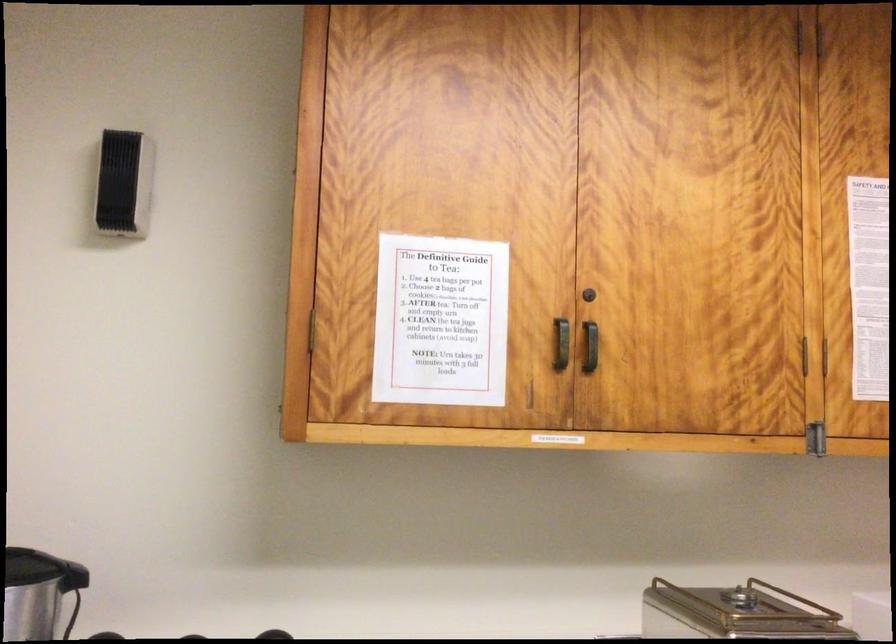
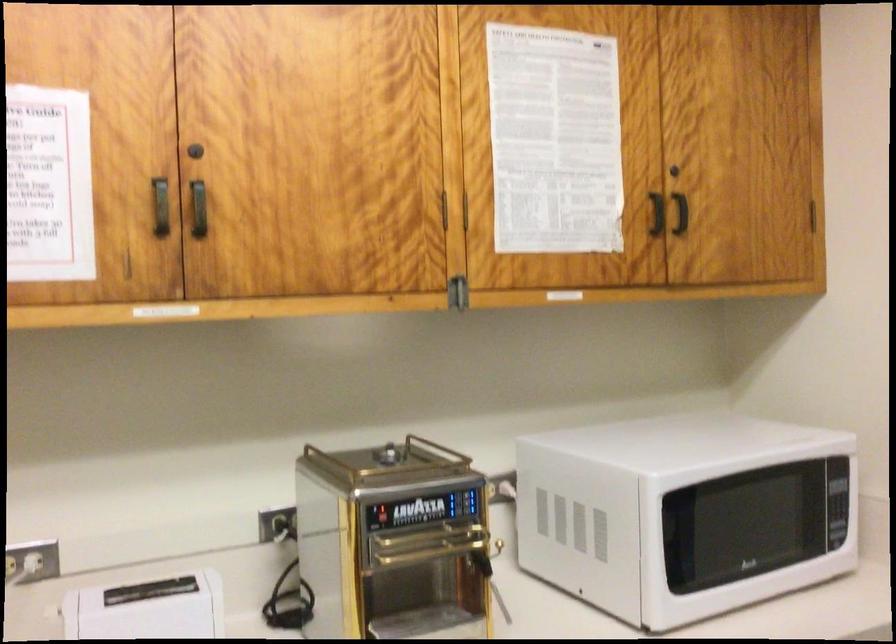
Question: The first image is from the beginning of the video and the second image is from the end. How did the camera likely rotate when shooting the video?

Choices:
 (A) Left
 (B) Right
 (C) Up
 (D) Down

Answer: (B)